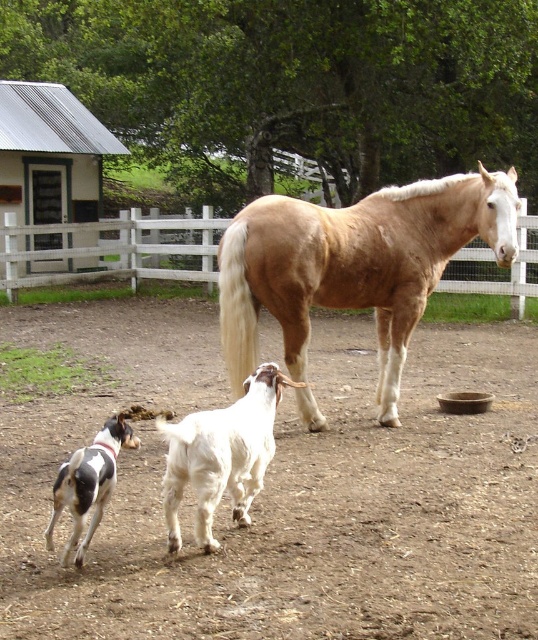
Question: Which object is the closest to the spotted fur dog at lower left?

Choices:
 (A) light brown glossy horse at center
 (B) brown dirt field at center
 (C) white wooden fence at center

Answer: (B)

Question: Can you confirm if light brown glossy horse at center is thinner than spotted fur dog at lower left?

Choices:
 (A) no
 (B) yes

Answer: (A)

Question: Which object is the farthest from the spotted fur dog at lower left?

Choices:
 (A) brown dirt field at center
 (B) white wooden fence at center
 (C) white fur dog at lower left

Answer: (B)

Question: Can you confirm if white fur dog at lower left is wider than spotted fur dog at lower left?

Choices:
 (A) no
 (B) yes

Answer: (B)

Question: Does white wooden fence at center appear on the left side of spotted fur dog at lower left?

Choices:
 (A) no
 (B) yes

Answer: (A)

Question: Which of the following is the closest to the observer?

Choices:
 (A) light brown glossy horse at center
 (B) white wooden fence at center
 (C) brown dirt field at center

Answer: (C)